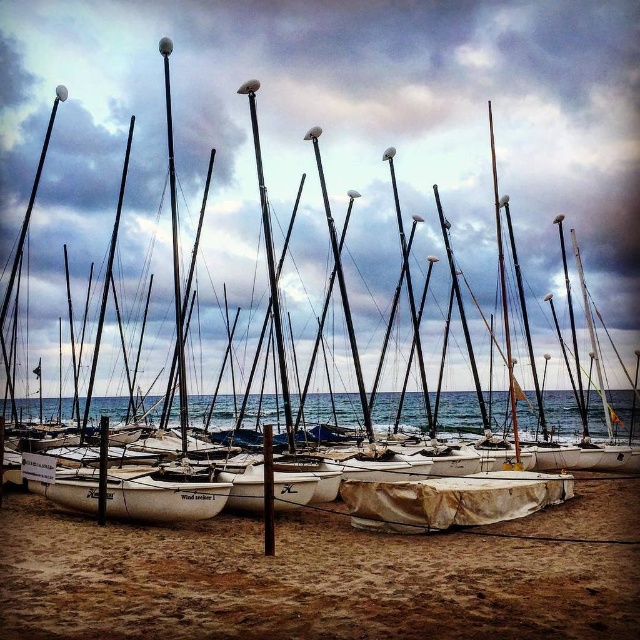
Can you confirm if white tarpaulin at center is shorter than blue water at center?

Yes.

Does white tarpaulin at center lie behind blue water at center?

That is False.

Describe the element at coordinates (323, 577) in the screenshot. The height and width of the screenshot is (640, 640). I see `white tarpaulin at center` at that location.

You are a GUI agent. You are given a task and a screenshot of the screen. Output one action in this format:
    pyautogui.click(x=<x>, y=<y>)
    Task: Click on the white tarpaulin at center
    
    Given the screenshot: What is the action you would take?
    coord(323,577)

Between blue water at center and white matte sailboat at center, which one appears on the right side from the viewer's perspective?

blue water at center

Can you confirm if blue water at center is smaller than white matte sailboat at center?

Incorrect, blue water at center is not smaller in size than white matte sailboat at center.

Does point (321, 403) lie behind point (170, 490)?

Yes.

The width and height of the screenshot is (640, 640). Find the location of `blue water at center`. blue water at center is located at coordinates (458, 412).

Does white tarpaulin at center have a greater height compared to white matte sailboat at center?

Yes, white tarpaulin at center is taller than white matte sailboat at center.

Can you confirm if white tarpaulin at center is wider than white matte sailboat at center?

Result: Yes.

Measure the distance between white tarpaulin at center and camera.

A distance of 97.32 feet exists between white tarpaulin at center and camera.

Locate an element on the screen. white tarpaulin at center is located at coordinates (323, 577).